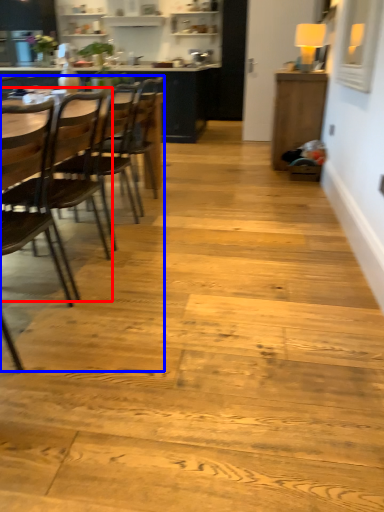
Question: Which point is closer to the camera, chair (highlighted by a red box) or armchair (highlighted by a blue box)?

Choices:
 (A) chair
 (B) armchair

Answer: (B)